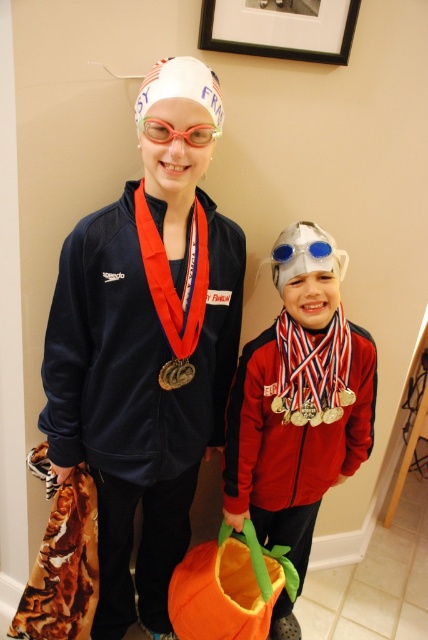
You are a photographer setting up for a sports awards ceremony. You need to place a standee that is 1.2 meters tall behind the shiny silver helmet at center and the gold metallic medal at lower center. Given their heights, will the standee be taller than both objects?

The shiny silver helmet at center is taller than the gold metallic medal at lower center. Since the standee is 1.2 meters tall, it will be taller than both objects as long as the helmet is shorter than 1.2 meters. However, the exact height of the helmet isn.t provided, so we can.t confirm definitively.

You are an art curator planning to display the black matte picture frame at upper center and the gold metallic medal at lower center in a gallery. Given their sizes, which object should be placed higher on the wall to maintain visual balance?

The black matte picture frame at upper center should be placed higher because its larger width compared to the gold metallic medal at lower center allows it to occupy more space, creating a balanced composition when positioned higher.